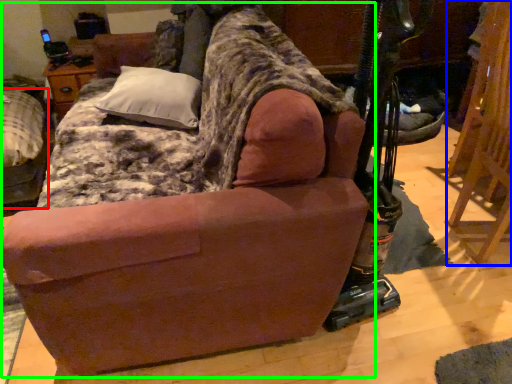
Question: Considering the real-world distances, which object is farthest from furniture (highlighted by a red box)? folding chair (highlighted by a blue box) or studio couch (highlighted by a green box)?

Choices:
 (A) folding chair
 (B) studio couch

Answer: (A)